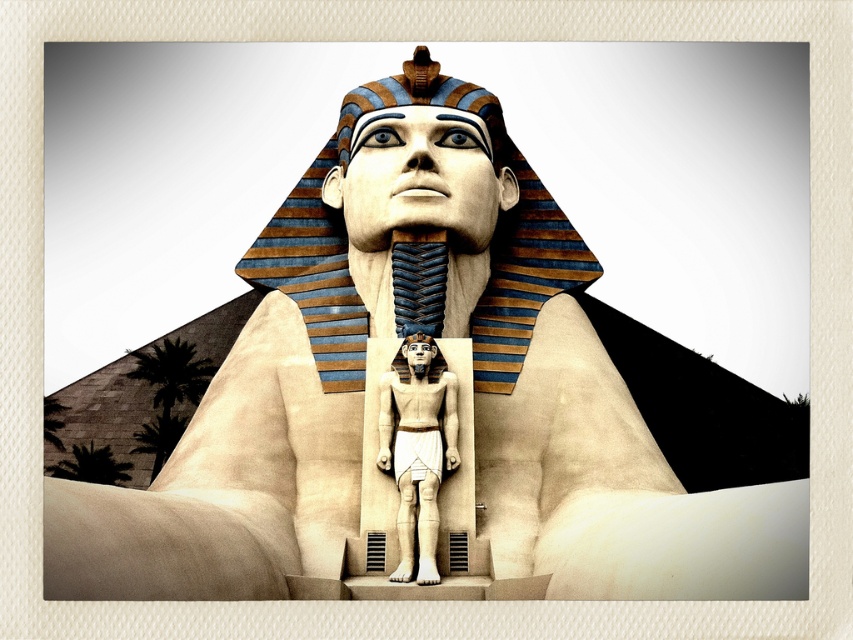
Who is higher up, white stone statue at center or matte gold statue at center?

matte gold statue at center is above.

Locate an element on the screen. white stone statue at center is located at coordinates (416, 445).

At what (x,y) coordinates should I click in order to perform the action: click on white stone statue at center. Please return your answer as a coordinate pair (x, y). The height and width of the screenshot is (640, 853). Looking at the image, I should click on (416, 445).

Is matte gold pharaoh head at center to the right of matte gold statue at center from the viewer's perspective?

Correct, you'll find matte gold pharaoh head at center to the right of matte gold statue at center.

Is matte gold pharaoh head at center further to the viewer compared to matte gold statue at center?

Yes.

Is point (396, 209) farther from camera compared to point (440, 362)?

Yes, point (396, 209) is behind point (440, 362).

This screenshot has height=640, width=853. Find the location of `matte gold pharaoh head at center`. matte gold pharaoh head at center is located at coordinates (419, 177).

Is matte gold pharaoh head at center wider than white stone statue at center?

Yes, matte gold pharaoh head at center is wider than white stone statue at center.

What do you see at coordinates (419, 177) in the screenshot? I see `matte gold pharaoh head at center` at bounding box center [419, 177].

Where is `matte gold pharaoh head at center`? This screenshot has height=640, width=853. matte gold pharaoh head at center is located at coordinates (419, 177).